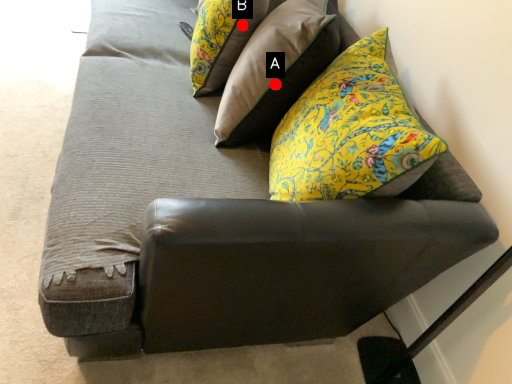
Question: Two points are circled on the image, labeled by A and B beside each circle. Which of the following is the closest to the observer?

Choices:
 (A) A is closer
 (B) B is closer

Answer: (A)